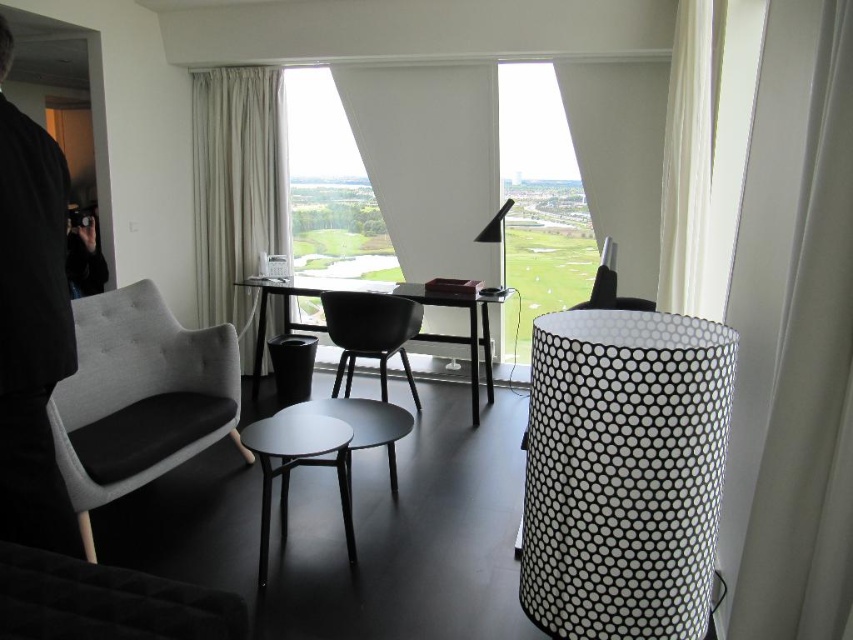
You are organizing a small event in the room and need to place a 10cm thick catalog on a surface. Can you put it on the black fabric jacket at left or the black glossy table at center?

The black fabric jacket at left is thinner than the black glossy table at center. Since the catalog is 10cm thick, it can be placed on the black glossy table at center which is thicker, but not on the jacket as it is thinner.